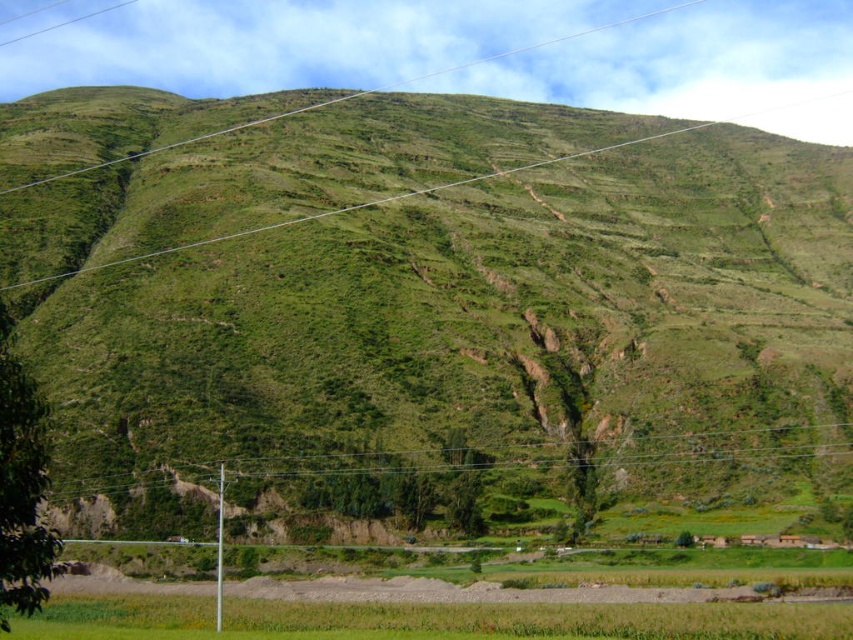
You are a farmer standing at the base of the hill looking up. You see the green grassy rice field at lower center and the green wire at center. Which object is closer to you?

The green grassy rice field at lower center is closer to you because it is in front of the green wire at center.